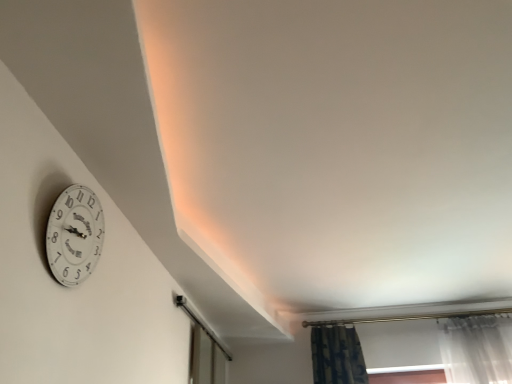
Question: Should I look upward or downward to see white glossy clock at upper left?

Choices:
 (A) up
 (B) down

Answer: (B)

Question: Considering the relative sizes of white glossy clock at upper left and transparent glass door at lower center in the image provided, is white glossy clock at upper left smaller than transparent glass door at lower center?

Choices:
 (A) no
 (B) yes

Answer: (B)

Question: Does white glossy clock at upper left lie behind transparent glass door at lower center?

Choices:
 (A) no
 (B) yes

Answer: (A)

Question: From a real-world perspective, is white glossy clock at upper left on top of transparent glass door at lower center?

Choices:
 (A) yes
 (B) no

Answer: (B)

Question: From a real-world perspective, is white glossy clock at upper left positioned under transparent glass door at lower center based on gravity?

Choices:
 (A) yes
 (B) no

Answer: (A)

Question: From the image's perspective, would you say white glossy clock at upper left is shown under transparent glass door at lower center?

Choices:
 (A) yes
 (B) no

Answer: (B)

Question: Is white glossy clock at upper left far away from transparent glass door at lower center?

Choices:
 (A) yes
 (B) no

Answer: (A)

Question: Is transparent glass door at lower center turned away from white glossy clock at upper left?

Choices:
 (A) yes
 (B) no

Answer: (B)

Question: Considering the relative sizes of transparent glass door at lower center and white glossy clock at upper left in the image provided, is transparent glass door at lower center smaller than white glossy clock at upper left?

Choices:
 (A) yes
 (B) no

Answer: (B)

Question: Is transparent glass door at lower center not inside white glossy clock at upper left?

Choices:
 (A) no
 (B) yes

Answer: (B)

Question: Is transparent glass door at lower center not near white glossy clock at upper left?

Choices:
 (A) no
 (B) yes

Answer: (B)

Question: Is transparent glass door at lower center beside white glossy clock at upper left?

Choices:
 (A) no
 (B) yes

Answer: (A)

Question: From the image's perspective, is transparent glass door at lower center above white glossy clock at upper left?

Choices:
 (A) yes
 (B) no

Answer: (B)

Question: Is white glossy clock at upper left situated inside transparent glass door at lower center or outside?

Choices:
 (A) inside
 (B) outside

Answer: (B)